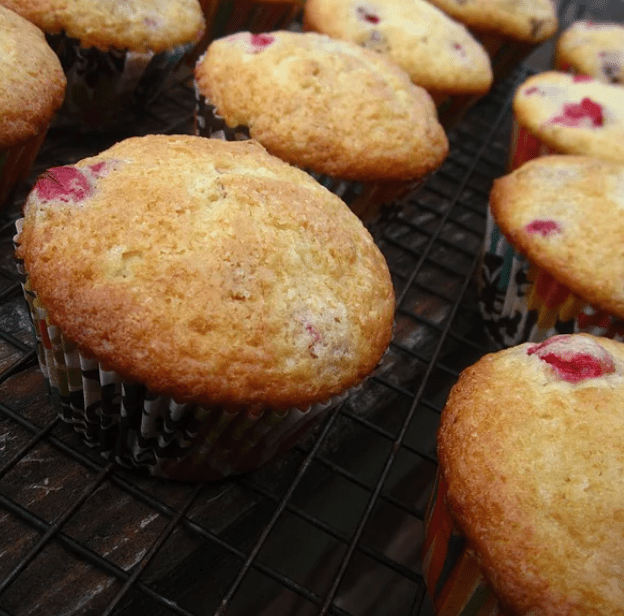
At what (x,y) coordinates should I click in order to perform the action: click on kitchen. Please return your answer as a coordinate pair (x, y). Looking at the image, I should click on (374, 505).